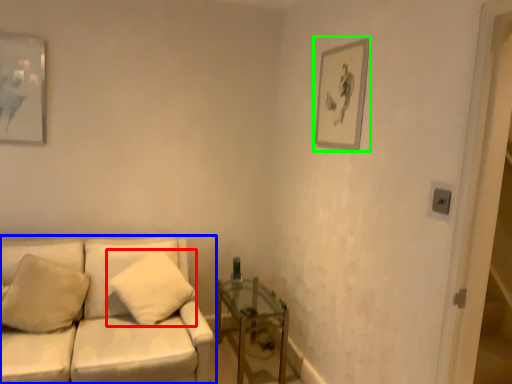
Question: Which object is positioned closest to pillow (highlighted by a red box)? Select from studio couch (highlighted by a blue box) and picture frame (highlighted by a green box).

Choices:
 (A) studio couch
 (B) picture frame

Answer: (A)